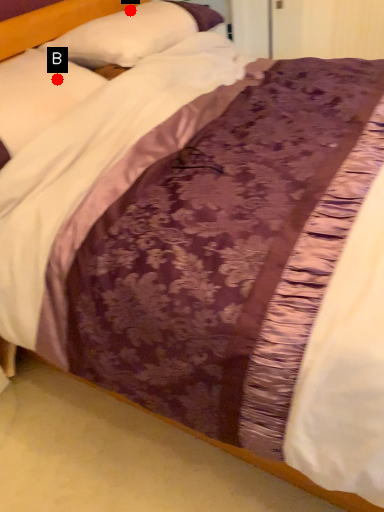
Question: Two points are circled on the image, labeled by A and B beside each circle. Which point is closer to the camera?

Choices:
 (A) A is closer
 (B) B is closer

Answer: (B)